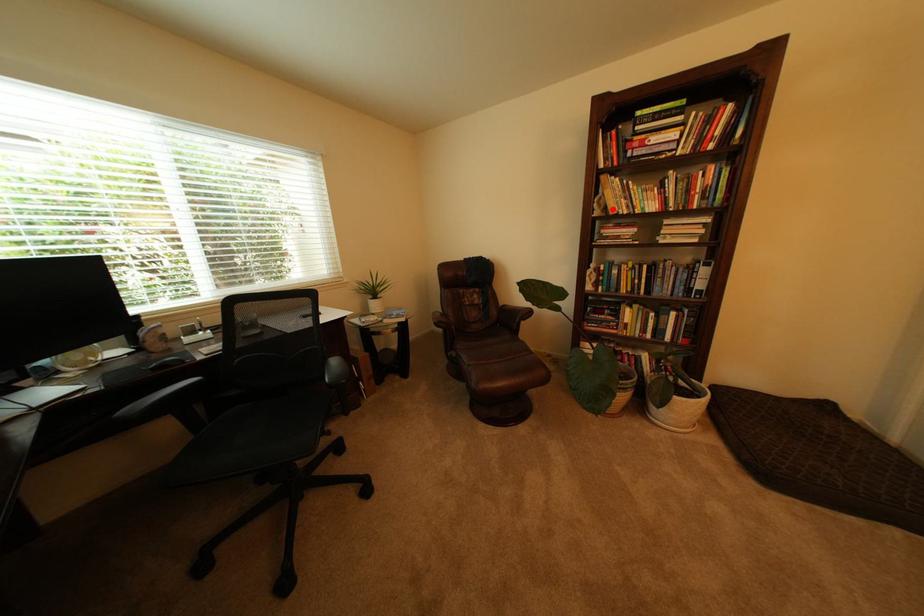
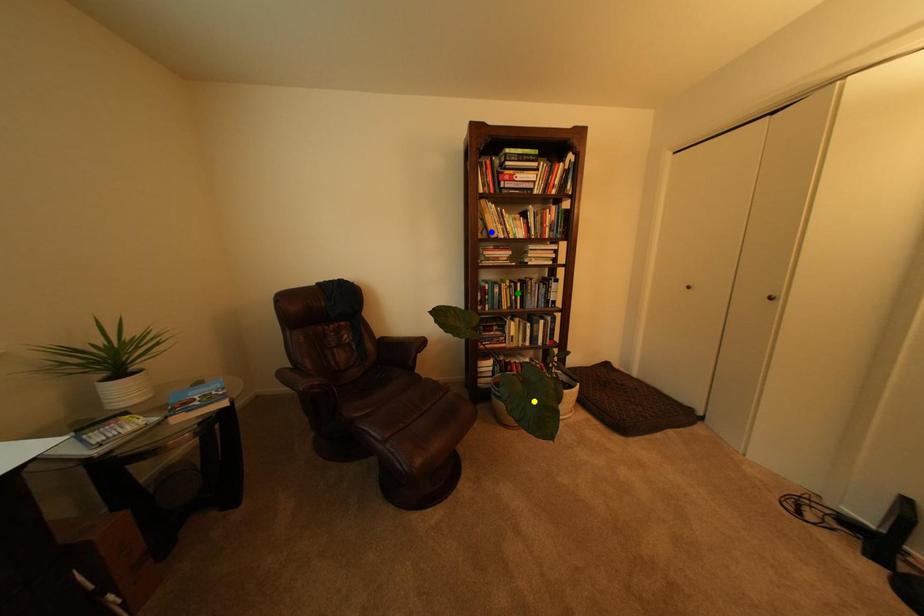
Question: I am providing you with two images of the same scene from different viewpoints. A red point is marked on the first image. You are given multiple points on the second image. In image 2, which mark is for the same physical point as the one in image 1?

Choices:
 (A) green point
 (B) yellow point
 (C) blue point

Answer: (C)